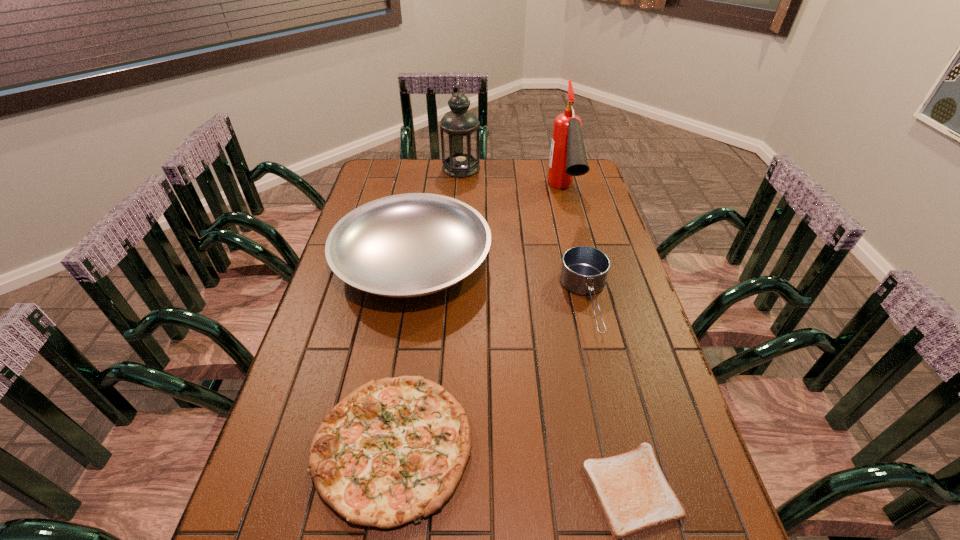
This screenshot has height=540, width=960. I want to click on oil lamp, so click(x=460, y=133).

I want to click on fire extinguisher, so click(x=568, y=158).

Find the location of a particular element. This screenshot has height=540, width=960. the third tallest object is located at coordinates (409, 245).

Image resolution: width=960 pixels, height=540 pixels. In order to click on the fourth tallest object in this screenshot , I will do `click(584, 270)`.

Where is `pizza`? This screenshot has height=540, width=960. pizza is located at coordinates (393, 451).

Identify the location of toast. The width and height of the screenshot is (960, 540). (634, 495).

At what (x,y) coordinates should I click in order to perform the action: click on vacant position located on the front of the oil lamp. Please return your answer as a coordinate pair (x, y). Looking at the image, I should click on (458, 227).

Image resolution: width=960 pixels, height=540 pixels. I want to click on free space located at the nozzle of the fire extinguisher, so click(573, 237).

Where is `vacant space located on the back of the fourth shortest object`? This screenshot has height=540, width=960. vacant space located on the back of the fourth shortest object is located at coordinates (425, 190).

You are a GUI agent. You are given a task and a screenshot of the screen. Output one action in this format:
    pyautogui.click(x=<x>, y=<y>)
    Task: Click on the free spot located 0.230m with the handle extending from one side of the third shortest object
    
    Given the screenshot: What is the action you would take?
    pyautogui.click(x=619, y=430)